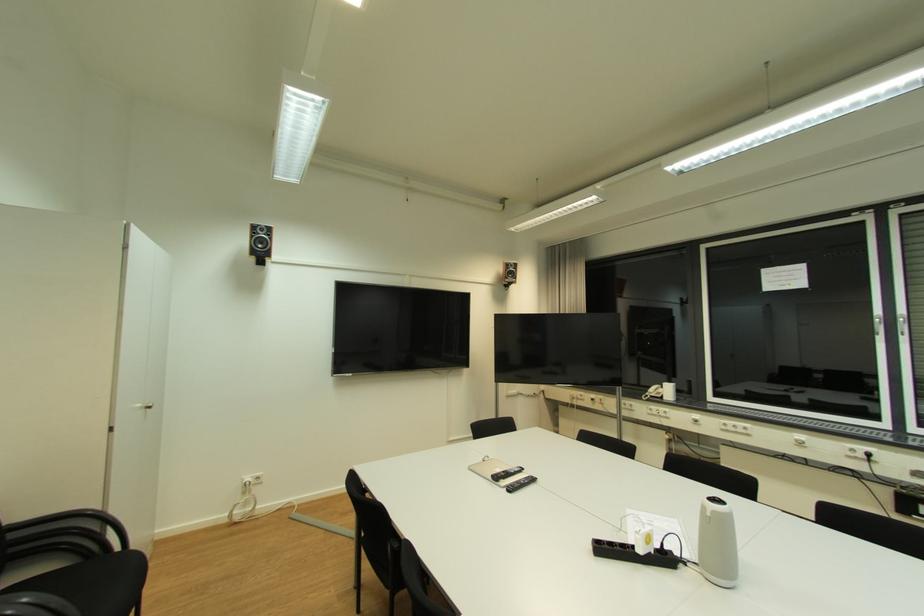
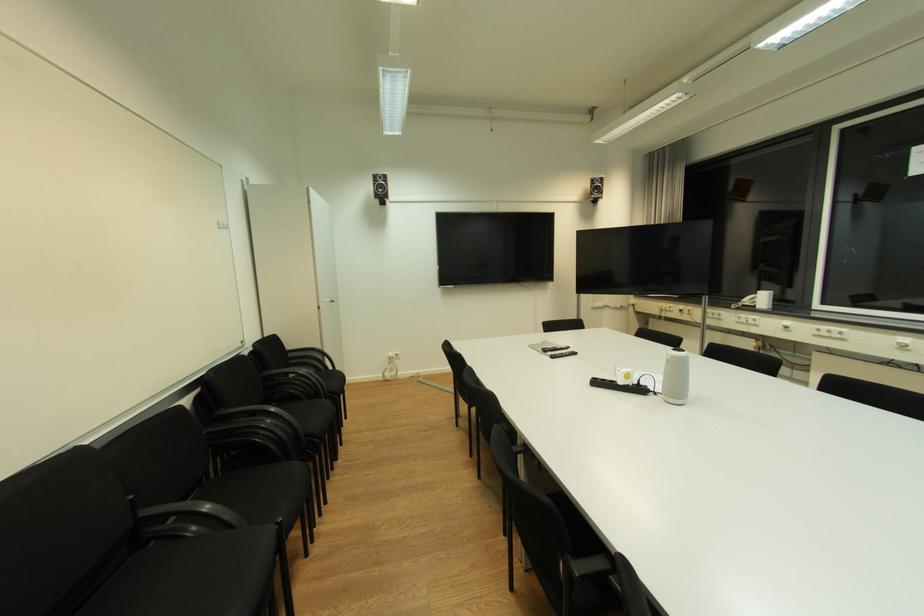
In a continuous first-person perspective shot, in which direction is the camera moving?

The movement direction of the cameraman is right, backward.